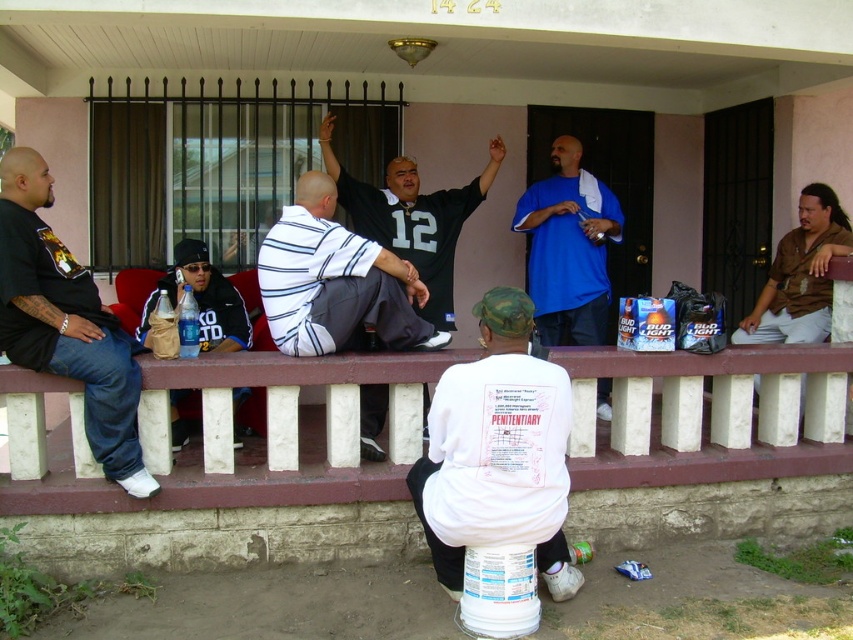
You are standing at the camera position and want to kick the dark blue jeans at left. Is it possible to reach them with your foot?

The dark blue jeans at left are 11.94 feet away from the camera, so it is not possible to reach them with your foot from that distance.

You are standing on the porch and want to hand a gift to the person wearing the blue cotton shirt at center without stepping on the dark blue jeans at left. Is this possible?

The dark blue jeans at left is positioned under the blue cotton shirt at center, so stepping around or beside the dark blue jeans at left would allow you to reach the blue cotton shirt at center without stepping on them.

You are trying to determine which item takes up more horizontal space in the image. Based on the scene, which is wider between the dark blue jeans at left and the matte black jacket at left?

The dark blue jeans at left is wider than the matte black jacket at left according to the description provided.